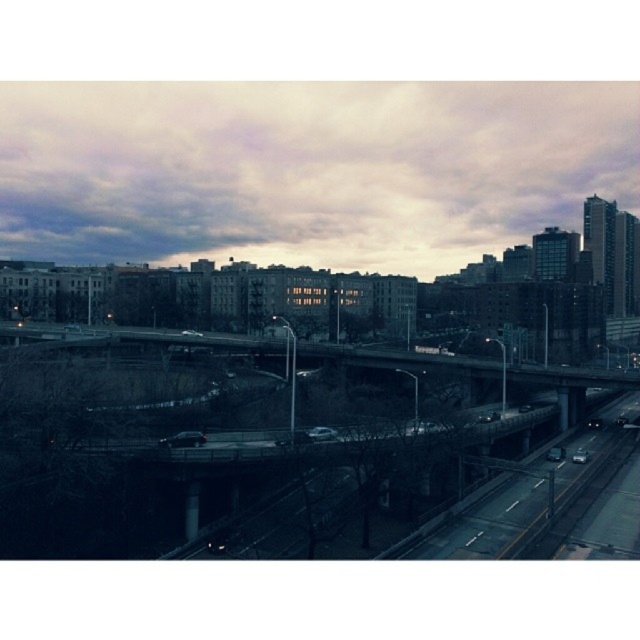
Question: Based on their relative distances, which object is nearer to the concrete bridge at lower left?

Choices:
 (A) cloudy sky at upper center
 (B) concrete bridge at center

Answer: (B)

Question: Which is nearer to the cloudy sky at upper center?

Choices:
 (A) concrete bridge at center
 (B) concrete bridge at lower left

Answer: (A)

Question: Does concrete bridge at center have a lesser width compared to concrete bridge at lower left?

Choices:
 (A) no
 (B) yes

Answer: (A)

Question: Is concrete bridge at center further to camera compared to cloudy sky at upper center?

Choices:
 (A) yes
 (B) no

Answer: (B)

Question: Which object is the closest to the cloudy sky at upper center?

Choices:
 (A) concrete bridge at lower left
 (B) concrete bridge at center

Answer: (B)

Question: Does cloudy sky at upper center have a greater width compared to concrete bridge at lower left?

Choices:
 (A) no
 (B) yes

Answer: (B)